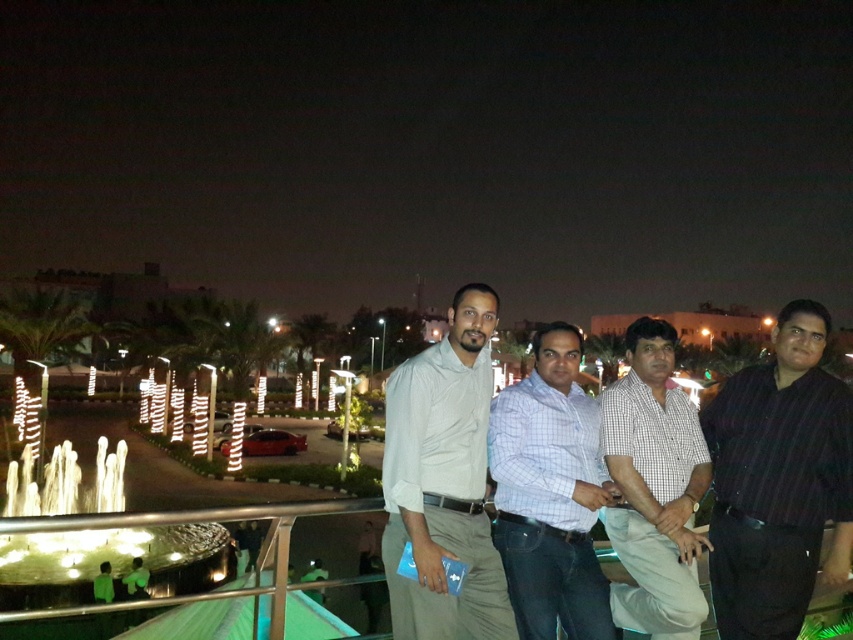
Question: Does dark striped shirt at right come behind white cotton shirt at center?

Choices:
 (A) yes
 (B) no

Answer: (A)

Question: Which object is closer to the camera taking this photo?

Choices:
 (A) dark striped shirt at right
 (B) light blue checkered shirt at center
 (C) white cotton shirt at center

Answer: (C)

Question: Which object is farther from the camera taking this photo?

Choices:
 (A) light blue checkered shirt at center
 (B) checkered fabric shirt at center
 (C) dark striped shirt at right

Answer: (C)

Question: Is dark striped shirt at right wider than light blue checkered shirt at center?

Choices:
 (A) yes
 (B) no

Answer: (A)

Question: Among these objects, which one is nearest to the camera?

Choices:
 (A) white cotton shirt at center
 (B) light blue checkered shirt at center
 (C) dark striped shirt at right

Answer: (A)

Question: Is dark striped shirt at right above checkered fabric shirt at center?

Choices:
 (A) no
 (B) yes

Answer: (B)